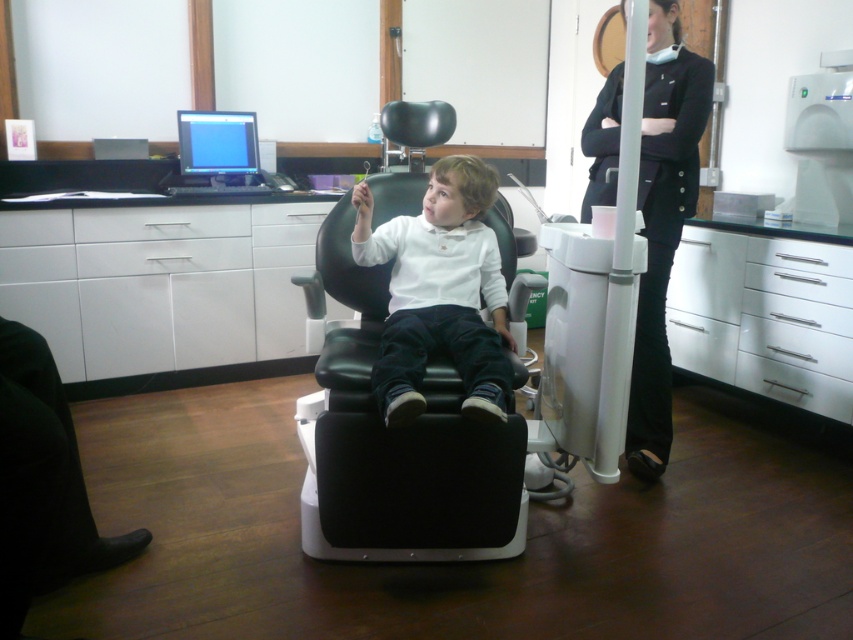
Question: Does black leather swivel chair at center have a lesser width compared to white glossy drawer at center?

Choices:
 (A) yes
 (B) no

Answer: (B)

Question: Among these points, which one is nearest to the camera?

Choices:
 (A) (677, 182)
 (B) (776, 360)

Answer: (A)

Question: Which of these objects is positioned farthest from the white glossy drawer at center?

Choices:
 (A) white glossy shirt at center
 (B) black leather swivel chair at center

Answer: (A)

Question: Which object appears closest to the camera in this image?

Choices:
 (A) white glossy drawer at center
 (B) black fabric pants at right
 (C) black leather swivel chair at center

Answer: (C)

Question: Is black leather swivel chair at center positioned at the back of white glossy shirt at center?

Choices:
 (A) no
 (B) yes

Answer: (B)

Question: Observing the image, what is the correct spatial positioning of white glossy shirt at center in reference to black fabric pants at right?

Choices:
 (A) left
 (B) right

Answer: (A)